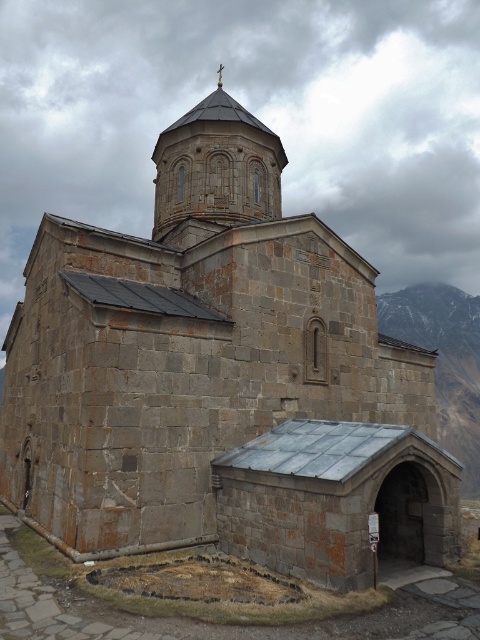
Question: Considering the relative positions of stone spire at upper center and snowy granite mountain at right in the image provided, where is stone spire at upper center located with respect to snowy granite mountain at right?

Choices:
 (A) right
 (B) left

Answer: (B)

Question: Which point is closer to the camera?

Choices:
 (A) (444, 422)
 (B) (204, 120)

Answer: (B)

Question: Is stone spire at upper center positioned behind snowy granite mountain at right?

Choices:
 (A) yes
 (B) no

Answer: (B)

Question: Where is stone spire at upper center located in relation to snowy granite mountain at right in the image?

Choices:
 (A) below
 (B) above

Answer: (B)

Question: Which of the following is the farthest from the observer?

Choices:
 (A) (472, 474)
 (B) (193, 140)

Answer: (A)